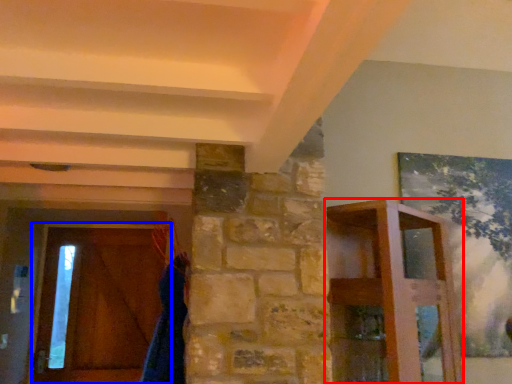
Question: Among these objects, which one is nearest to the camera, furniture (highlighted by a red box) or barn door (highlighted by a blue box)?

Choices:
 (A) furniture
 (B) barn door

Answer: (A)